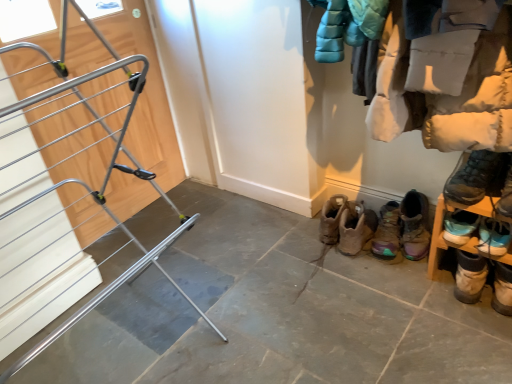
Locate an element on the screen. This screenshot has height=384, width=512. vacant space that is in between silver metallic drying rack at left and multicolored suede boot at lower right, which ranks as the fourth footwear in right-to-left order is located at coordinates (279, 302).